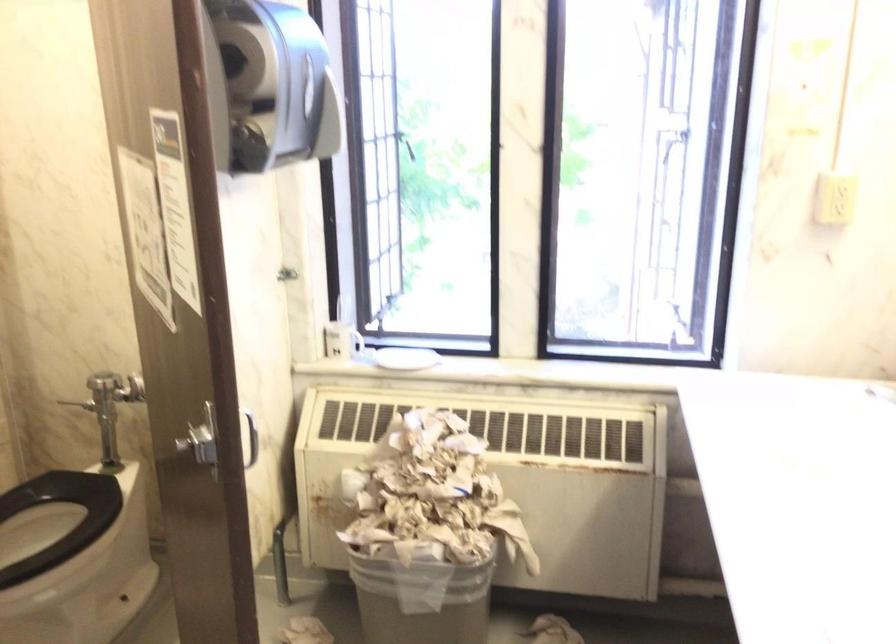
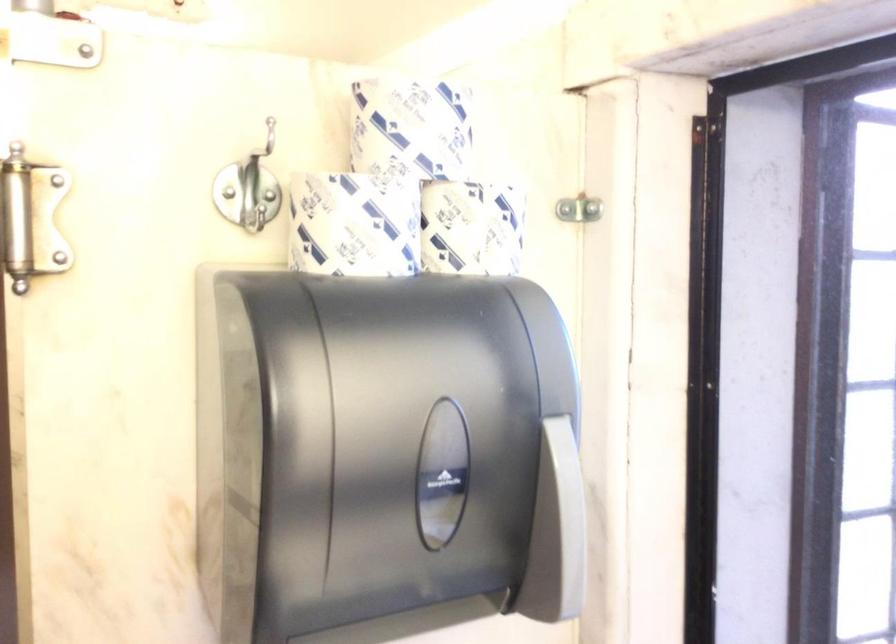
The point at (338, 109) is marked in the first image. Where is the corresponding point in the second image?

(557, 532)